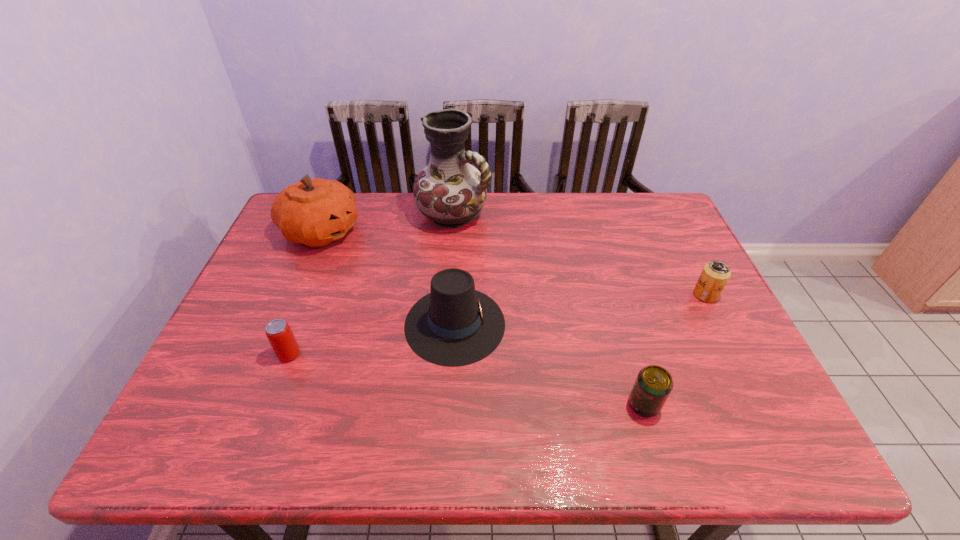
The image size is (960, 540). Find the location of `free space between the farthest beer can and the fourth shortest object`. free space between the farthest beer can and the fourth shortest object is located at coordinates (580, 309).

Locate an element on the screen. vacant area that lies between the fourth shortest object and the pumpkin is located at coordinates (388, 278).

Identify the location of vacant area that lies between the tallest object and the second beer can from left to right. The width and height of the screenshot is (960, 540). (549, 309).

What are the coordinates of `free space between the third tallest object and the second object from right to left` in the screenshot? It's located at [x=549, y=364].

Image resolution: width=960 pixels, height=540 pixels. I want to click on free spot between the fourth shortest object and the fifth shortest object, so click(x=388, y=278).

Locate an element on the screen. empty space that is in between the pumpkin and the fourth shortest object is located at coordinates (388, 278).

At what (x,y) coordinates should I click in order to perform the action: click on object that is the third closest one to the vase. Please return your answer as a coordinate pair (x, y). This screenshot has width=960, height=540. Looking at the image, I should click on [282, 340].

You are a GUI agent. You are given a task and a screenshot of the screen. Output one action in this format:
    pyautogui.click(x=<x>, y=<y>)
    Task: Click on the object that is the fourth closest to the nearest beer can
    
    Given the screenshot: What is the action you would take?
    pyautogui.click(x=282, y=340)

Identify which beer can is the nearest to the nearest beer can. Please provide its 2D coordinates. Your answer should be formatted as a tuple, i.e. [(x, y)], where the tuple contains the x and y coordinates of a point satisfying the conditions above.

[(715, 274)]

Locate which beer can is the second closest to the pumpkin. Please provide its 2D coordinates. Your answer should be formatted as a tuple, i.e. [(x, y)], where the tuple contains the x and y coordinates of a point satisfying the conditions above.

[(653, 385)]